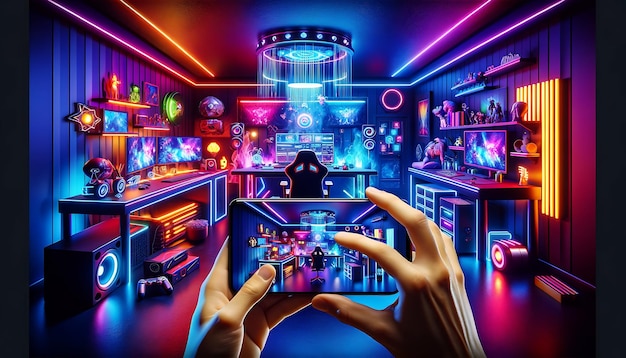
Identify the location of computer monitor. The height and width of the screenshot is (358, 626). (141, 146), (187, 145), (290, 147), (491, 157).